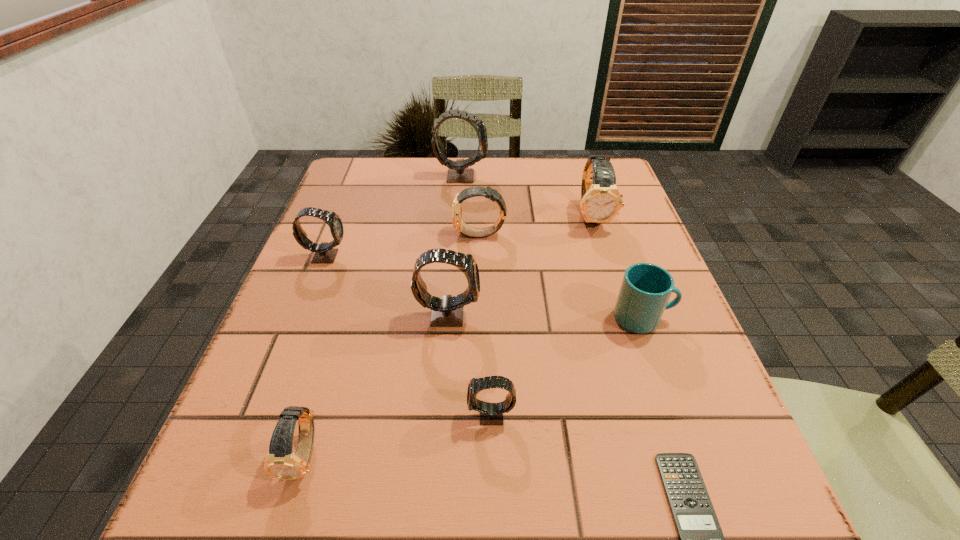
Find the location of a particular element. free space at the left edge is located at coordinates (319, 378).

Identify the location of free space at the right edge of the desktop. The image size is (960, 540). coord(662,411).

Find the location of a particular element. The height and width of the screenshot is (540, 960). vacant space at the far left corner of the desktop is located at coordinates (361, 199).

The image size is (960, 540). In the image, there is a desktop. Find the location of `free space at the far right corner`. free space at the far right corner is located at coordinates (566, 161).

Find the location of `empty space between the second smallest gray watch and the biggest gold watch`. empty space between the second smallest gray watch and the biggest gold watch is located at coordinates pos(459,236).

What are the coordinates of `free space between the second smallest gold watch and the nearest gold watch` in the screenshot? It's located at (393, 345).

The width and height of the screenshot is (960, 540). I want to click on free spot between the second watch from left to right and the second farthest gray watch, so click(315, 355).

The height and width of the screenshot is (540, 960). I want to click on free space between the rightmost gold watch and the second gold watch from left to right, so pos(536,225).

I want to click on blank region between the nearest gray watch and the second biggest gold watch, so click(486, 325).

The width and height of the screenshot is (960, 540). Find the location of `unoccupied area between the sixth nearest object and the leftmost gold watch`. unoccupied area between the sixth nearest object and the leftmost gold watch is located at coordinates (315, 355).